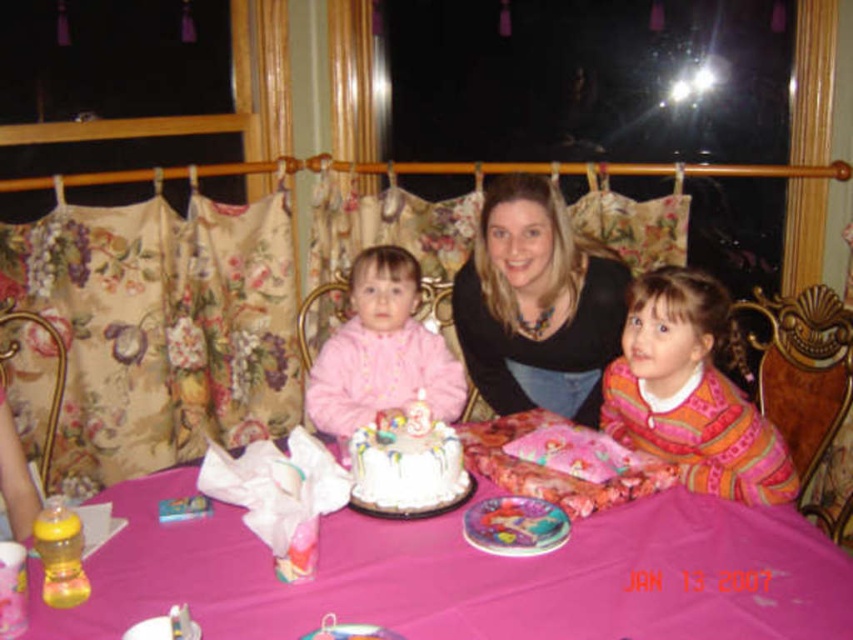
Question: Can you confirm if pink fabric table at center is positioned to the right of pink fleece jacket at center?

Choices:
 (A) no
 (B) yes

Answer: (B)

Question: Which point appears closest to the camera in this image?

Choices:
 (A) tap(451, 468)
 (B) tap(474, 276)
 (C) tap(746, 401)

Answer: (A)

Question: Estimate the real-world distances between objects in this image. Which object is closer to the pink fleece jacket at center?

Choices:
 (A) matte black sweater at center
 (B) orange knitted sweater at right

Answer: (A)

Question: Is pink fleece jacket at center below white frosted cake at center?

Choices:
 (A) yes
 (B) no

Answer: (B)

Question: Which of the following is the closest to the observer?

Choices:
 (A) (637, 337)
 (B) (392, 481)

Answer: (B)

Question: Is matte black sweater at center positioned behind orange knitted sweater at right?

Choices:
 (A) no
 (B) yes

Answer: (B)